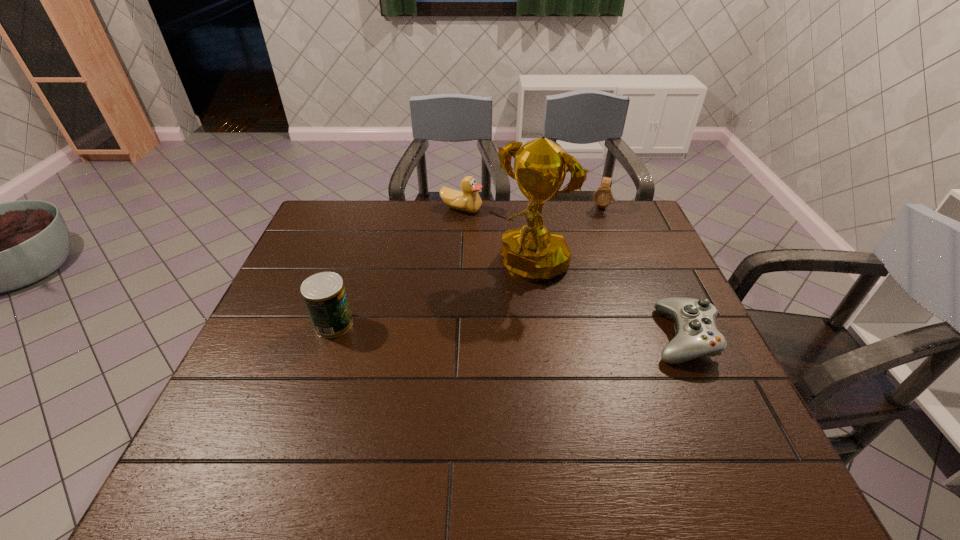
At what (x,y) coordinates should I click in order to perform the action: click on empty location between the award and the watch. Please return your answer as a coordinate pair (x, y). The width and height of the screenshot is (960, 540). Looking at the image, I should click on pyautogui.click(x=564, y=235).

Locate an element on the screen. The width and height of the screenshot is (960, 540). vacant point located between the shortest object and the can is located at coordinates tap(508, 330).

You are a GUI agent. You are given a task and a screenshot of the screen. Output one action in this format:
    pyautogui.click(x=<x>, y=<y>)
    Task: Click on the vacant point located between the leftmost object and the control
    
    Given the screenshot: What is the action you would take?
    pyautogui.click(x=508, y=330)

At what (x,y) coordinates should I click in order to perform the action: click on empty location between the fourth object from right to left and the tallest object. Please return your answer as a coordinate pair (x, y). Looking at the image, I should click on (494, 237).

At what (x,y) coordinates should I click in order to perform the action: click on free spot between the watch and the control. Please return your answer as a coordinate pair (x, y). Image resolution: width=960 pixels, height=540 pixels. Looking at the image, I should click on (641, 272).

Identify the location of vacant point located between the watch and the leftmost object. The width and height of the screenshot is (960, 540). (467, 265).

What are the coordinates of `vacant space that's between the fourth object from right to left and the can` in the screenshot? It's located at (397, 266).

Locate which object is the closest to the watch. Please provide its 2D coordinates. Your answer should be formatted as a tuple, i.e. [(x, y)], where the tuple contains the x and y coordinates of a point satisfying the conditions above.

[(532, 253)]

The height and width of the screenshot is (540, 960). I want to click on object that is the fourth closest to the fourth object from right to left, so click(697, 335).

You are a GUI agent. You are given a task and a screenshot of the screen. Output one action in this format:
    pyautogui.click(x=<x>, y=<y>)
    Task: Click on the free location that satisfies the following two spatial constraints: 1. on the front side of the award; 2. on the left side of the control
    The image size is (960, 540).
    Given the screenshot: What is the action you would take?
    tap(537, 336)